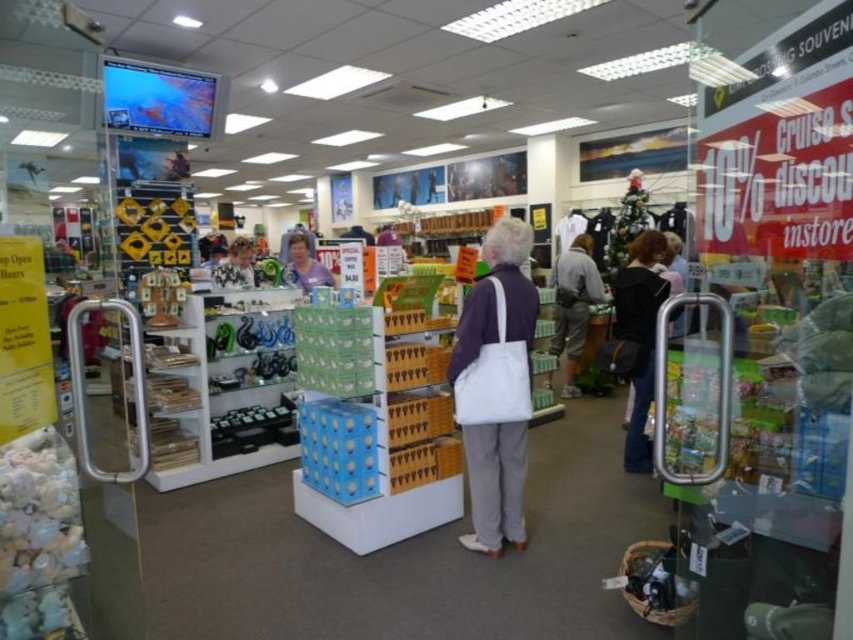
Does black fabric purse at center appear over light gray fabric backpack at center?

Actually, black fabric purse at center is below light gray fabric backpack at center.

Between black fabric purse at center and light gray fabric backpack at center, which one has less height?

With less height is black fabric purse at center.

Locate an element on the screen. Image resolution: width=853 pixels, height=640 pixels. black fabric purse at center is located at coordinates (640, 333).

Does white canvas tote bag at center appear on the left side of light gray fabric backpack at center?

Yes, white canvas tote bag at center is to the left of light gray fabric backpack at center.

Consider the image. Which is more to the right, white canvas tote bag at center or light gray fabric backpack at center?

Positioned to the right is light gray fabric backpack at center.

Which is in front, point (494, 481) or point (577, 321)?

Point (494, 481)

This screenshot has height=640, width=853. I want to click on white canvas tote bag at center, so click(x=496, y=387).

Who is shorter, white canvas tote bag at center or purple fabric shirt at center?

purple fabric shirt at center is shorter.

Is white canvas tote bag at center further to camera compared to purple fabric shirt at center?

No, it is not.

Which is in front, point (474, 422) or point (300, 284)?

Point (474, 422) is in front.

This screenshot has width=853, height=640. Find the location of `white canvas tote bag at center`. white canvas tote bag at center is located at coordinates (496, 387).